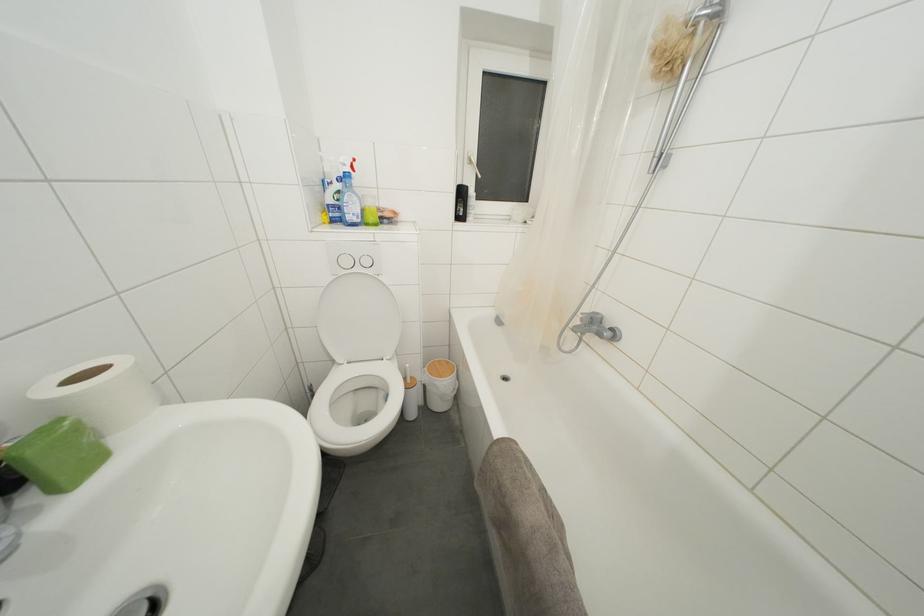
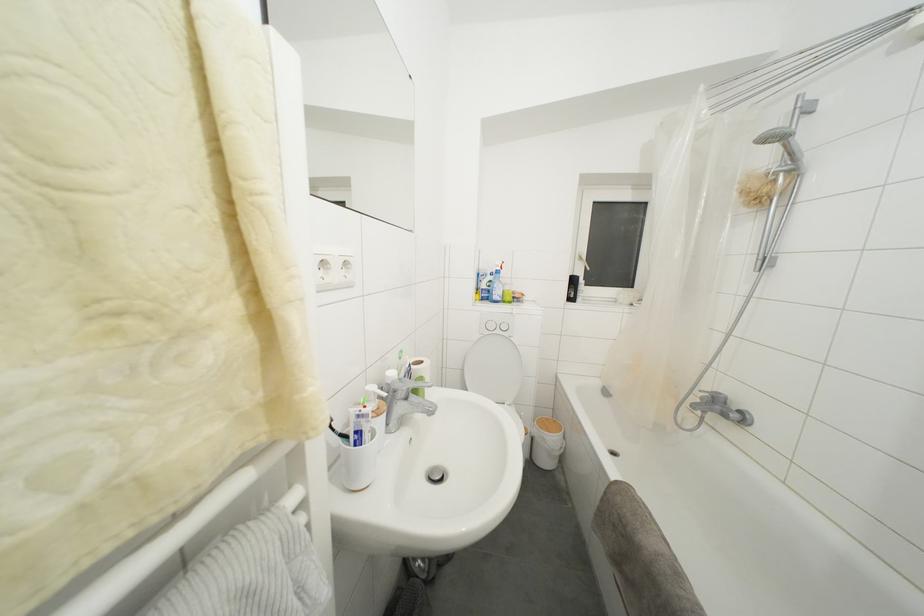
Question: In a continuous first-person perspective shot, in which direction is the camera moving?

Choices:
 (A) Left
 (B) Right
 (C) Forward
 (D) Backward

Answer: (D)